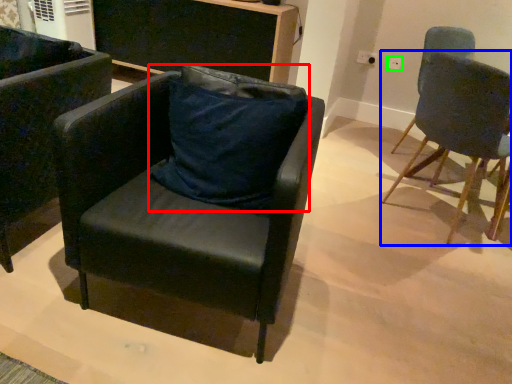
Question: Estimate the real-world distances between objects in this image. Which object is closer to pillow (highlighted by a red box), chair (highlighted by a blue box) or power outlet (highlighted by a green box)?

Choices:
 (A) chair
 (B) power outlet

Answer: (A)